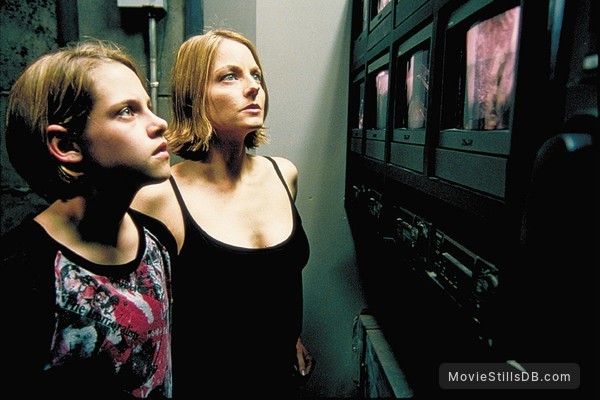
Locate an element on the screen. This screenshot has width=600, height=400. tv screens is located at coordinates (491, 97), (410, 86), (374, 90), (360, 103).